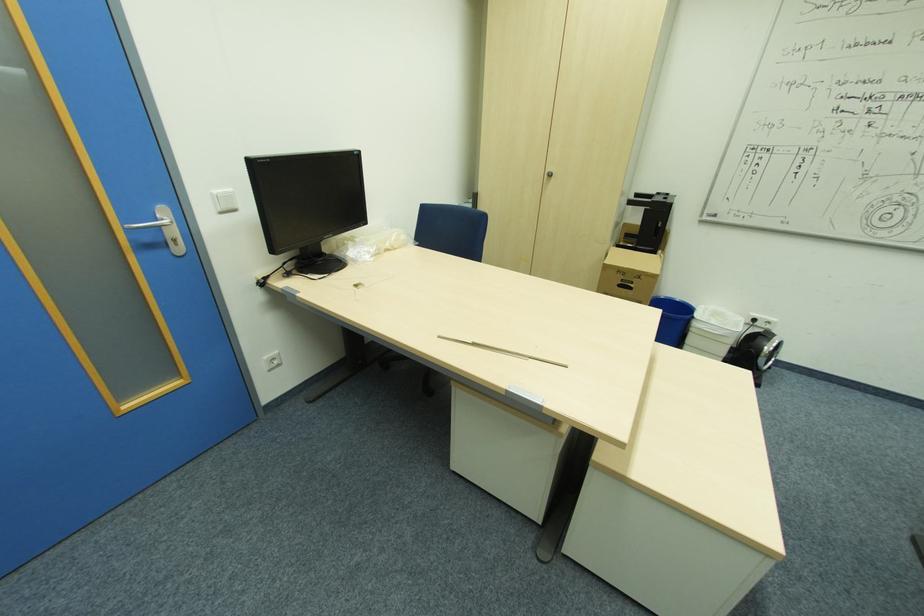
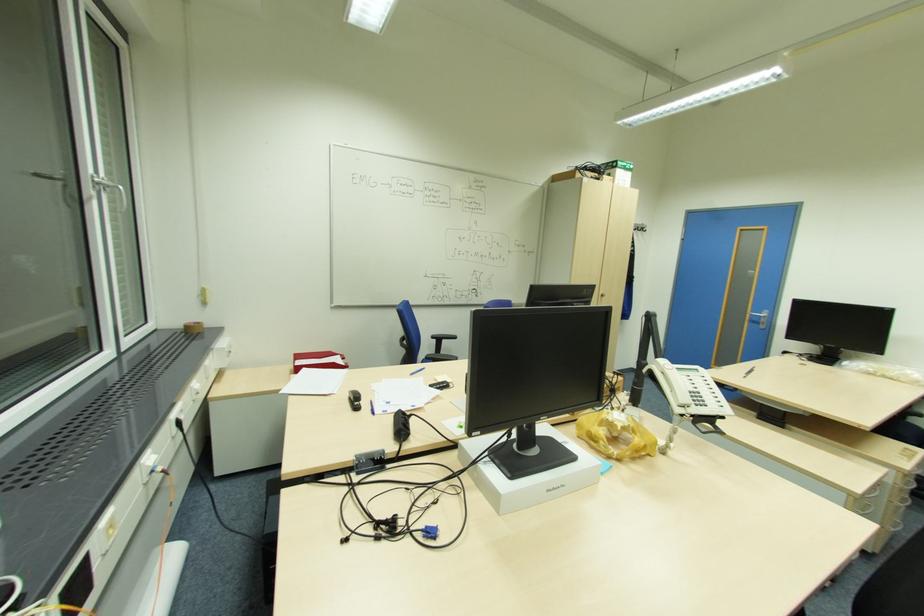
Question: I am providing you with two images of the same scene from different viewpoints. Please identify which objects are invisible in image2.

Choices:
 (A) cabinet door handle
 (B) white patterned mug
 (C) white telephone handset
 (D) white light switch

Answer: (D)